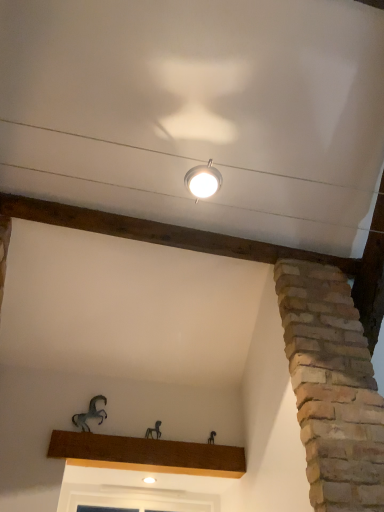
Question: Is metallic horse at center, which appears as the 2th animal when viewed from the left, wider or thinner than metallic horse at lower left, acting as the first animal starting from the top?

Choices:
 (A) thin
 (B) wide

Answer: (A)

Question: From a real-world perspective, relative to metallic horse at lower left, marked as the second animal in a right-to-left arrangement, is metallic horse at center, which appears as the 2th animal when viewed from the left, vertically above or below?

Choices:
 (A) above
 (B) below

Answer: (B)

Question: Which of these objects is positioned closest to the metallic horse at center, which appears as the 2th animal when viewed from the left?

Choices:
 (A) brown wood at center
 (B) metallic horse at lower left, marked as the second animal in a right-to-left arrangement
 (C) matte silver lamp at upper center

Answer: (A)

Question: Estimate the real-world distances between objects in this image. Which object is farther from the brown wood at center?

Choices:
 (A) metallic horse at center, the 1th animal in the right-to-left sequence
 (B) matte silver lamp at upper center
 (C) metallic horse at lower left, marked as the second animal in a right-to-left arrangement

Answer: (B)